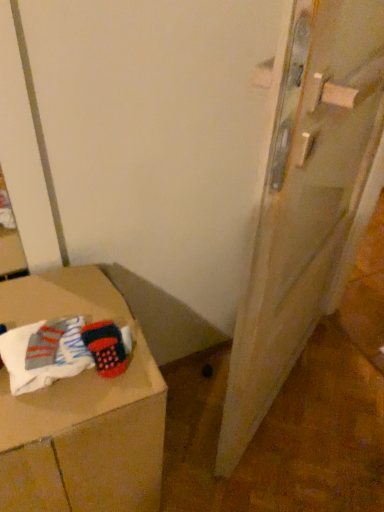
You are a GUI agent. You are given a task and a screenshot of the screen. Output one action in this format:
    pyautogui.click(x=<x>, y=<y>)
    Task: Click on the free location above cardboard box at lower left (from a real-world perspective)
    Image resolution: width=384 pixels, height=512 pixels.
    Given the screenshot: What is the action you would take?
    (x=56, y=340)